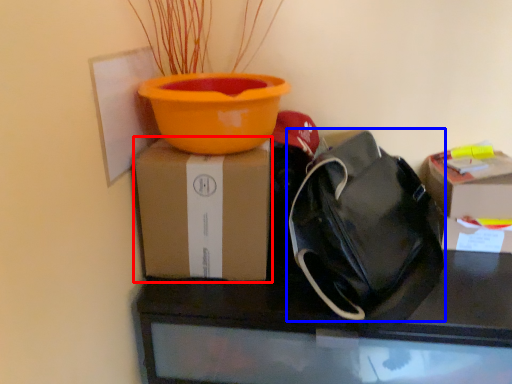
Question: Among these objects, which one is farthest to the camera, box (highlighted by a red box) or handbag (highlighted by a blue box)?

Choices:
 (A) box
 (B) handbag

Answer: (A)